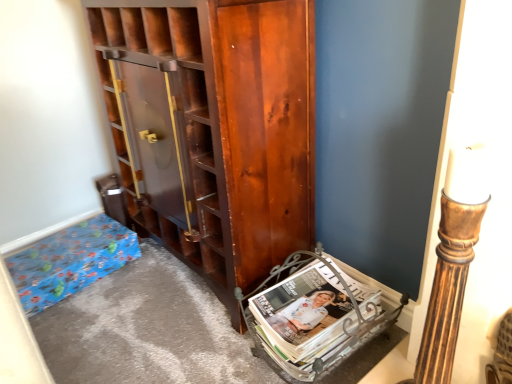
What is the approximate width of matte metallic magazine rack at lower right?

The width of matte metallic magazine rack at lower right is 12.83 inches.

The width and height of the screenshot is (512, 384). What do you see at coordinates (70, 261) in the screenshot?
I see `blue paper bag at lower left` at bounding box center [70, 261].

Where is `matte metallic magazine rack at lower right`? matte metallic magazine rack at lower right is located at coordinates (313, 318).

Are blue paper bag at lower left and shiny brown cabinet at center located far from each other?

No, blue paper bag at lower left is in close proximity to shiny brown cabinet at center.

Is blue paper bag at lower left oriented towards shiny brown cabinet at center?

No, blue paper bag at lower left is not turned towards shiny brown cabinet at center.

Can you confirm if blue paper bag at lower left is taller than shiny brown cabinet at center?

No.

Who is smaller, blue paper bag at lower left or shiny brown cabinet at center?

blue paper bag at lower left is smaller.

Relative to matte metallic magazine rack at lower right, is blue paper bag at lower left in front or behind?

In the image, blue paper bag at lower left appears behind matte metallic magazine rack at lower right.

Consider the image. Would you say blue paper bag at lower left is outside matte metallic magazine rack at lower right?

Yes.

Is blue paper bag at lower left facing towards matte metallic magazine rack at lower right?

Yes, blue paper bag at lower left is facing matte metallic magazine rack at lower right.

Does point (85, 242) lie behind point (289, 291)?

Yes.

Considering the sizes of objects matte metallic magazine rack at lower right and shiny brown cabinet at center in the image provided, who is wider, matte metallic magazine rack at lower right or shiny brown cabinet at center?

shiny brown cabinet at center.

Is matte metallic magazine rack at lower right oriented towards shiny brown cabinet at center?

No, matte metallic magazine rack at lower right is not oriented towards shiny brown cabinet at center.

Is matte metallic magazine rack at lower right bigger or smaller than shiny brown cabinet at center?

matte metallic magazine rack at lower right is smaller than shiny brown cabinet at center.

Which is more distant, (136, 41) or (72, 265)?

The point (72, 265) is farther.

Can you tell me how much shiny brown cabinet at center and blue paper bag at lower left differ in facing direction?

There is a 96-degree angle between the facing directions of shiny brown cabinet at center and blue paper bag at lower left.

From a real-world perspective, is shiny brown cabinet at center on top of blue paper bag at lower left?

Indeed, from a real-world perspective, shiny brown cabinet at center stands above blue paper bag at lower left.

Looking at their sizes, would you say shiny brown cabinet at center is wider or thinner than matte metallic magazine rack at lower right?

In the image, shiny brown cabinet at center appears to be wider than matte metallic magazine rack at lower right.

Based on the photo, which of these two, shiny brown cabinet at center or matte metallic magazine rack at lower right, stands taller?

shiny brown cabinet at center is taller.

Is shiny brown cabinet at center further to the viewer compared to matte metallic magazine rack at lower right?

No, shiny brown cabinet at center is closer to the viewer.

Can we say shiny brown cabinet at center lies outside matte metallic magazine rack at lower right?

Yes, shiny brown cabinet at center is not within matte metallic magazine rack at lower right.

Which of these two, matte metallic magazine rack at lower right or blue paper bag at lower left, is wider?

With larger width is matte metallic magazine rack at lower right.

Which is closer to the camera, (256, 319) or (129, 256)?

Point (256, 319) is closer to the camera than point (129, 256).

Is matte metallic magazine rack at lower right taller than blue paper bag at lower left?

Yes.

Identify the location of cabinetry that is in front of the blue paper bag at lower left. tap(213, 128).

This screenshot has height=384, width=512. I want to click on magazine that appears above the blue paper bag at lower left (from a real-world perspective), so [313, 318].

From the image, which object appears to be nearer to shiny brown cabinet at center, matte metallic magazine rack at lower right or blue paper bag at lower left?

Based on the image, matte metallic magazine rack at lower right appears to be nearer to shiny brown cabinet at center.

Which object lies further to the anchor point matte metallic magazine rack at lower right, shiny brown cabinet at center or blue paper bag at lower left?

Among the two, blue paper bag at lower left is located further to matte metallic magazine rack at lower right.

Looking at the image, which one is located closer to matte metallic magazine rack at lower right, blue paper bag at lower left or shiny brown cabinet at center?

shiny brown cabinet at center lies closer to matte metallic magazine rack at lower right than the other object.

Which object lies nearer to the anchor point blue paper bag at lower left, shiny brown cabinet at center or matte metallic magazine rack at lower right?

Among the two, shiny brown cabinet at center is located nearer to blue paper bag at lower left.

Consider the image. Considering their positions, is blue paper bag at lower left positioned closer to shiny brown cabinet at center than matte metallic magazine rack at lower right?

The object closer to shiny brown cabinet at center is matte metallic magazine rack at lower right.

Considering their positions, is matte metallic magazine rack at lower right positioned further to blue paper bag at lower left than shiny brown cabinet at center?

matte metallic magazine rack at lower right is further to blue paper bag at lower left.

I want to click on cabinetry between blue paper bag at lower left and matte metallic magazine rack at lower right, so click(x=213, y=128).